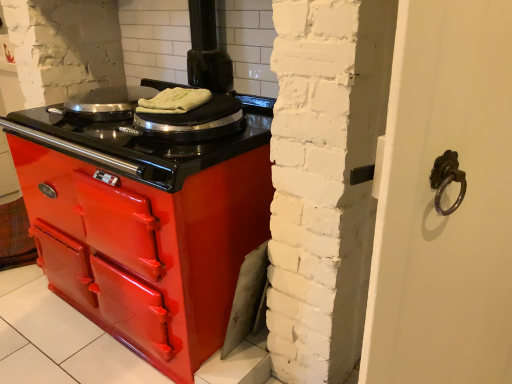
Identify the location of shiny metallic pan at upper left. This screenshot has height=384, width=512. (104, 103).

The image size is (512, 384). Describe the element at coordinates (104, 103) in the screenshot. I see `shiny metallic pan at upper left` at that location.

Where is `white cloth at center`? white cloth at center is located at coordinates (174, 101).

This screenshot has height=384, width=512. What do you see at coordinates (174, 101) in the screenshot?
I see `white cloth at center` at bounding box center [174, 101].

Where is `shiny metallic pan at upper left`? The height and width of the screenshot is (384, 512). shiny metallic pan at upper left is located at coordinates (104, 103).

Is shiny metallic pan at upper left to the left of white cloth at center from the viewer's perspective?

Yes, shiny metallic pan at upper left is to the left of white cloth at center.

Relative to white cloth at center, is shiny metallic pan at upper left in front or behind?

Clearly, shiny metallic pan at upper left is behind white cloth at center.

Considering the points (89, 100) and (156, 97), which point is behind, point (89, 100) or point (156, 97)?

The point (89, 100) is more distant.

From the image's perspective, does shiny metallic pan at upper left appear lower than white cloth at center?

No.

From a real-world perspective, is shiny metallic pan at upper left positioned above or below white cloth at center?

Clearly, from a real-world perspective, shiny metallic pan at upper left is below white cloth at center.

Which object is wider, shiny metallic pan at upper left or white cloth at center?

shiny metallic pan at upper left.

Who is taller, shiny metallic pan at upper left or white cloth at center?

shiny metallic pan at upper left.

Considering the relative sizes of shiny metallic pan at upper left and white cloth at center in the image provided, is shiny metallic pan at upper left bigger than white cloth at center?

Indeed, shiny metallic pan at upper left has a larger size compared to white cloth at center.

Choose the correct answer: Is shiny metallic pan at upper left inside white cloth at center or outside it?

shiny metallic pan at upper left cannot be found inside white cloth at center.

Are shiny metallic pan at upper left and white cloth at center located far from each other?

No, there isn't a large distance between shiny metallic pan at upper left and white cloth at center.

Is shiny metallic pan at upper left oriented towards white cloth at center?

No, shiny metallic pan at upper left is not aimed at white cloth at center.

How different are the orientations of shiny metallic pan at upper left and white cloth at center in degrees?

There is a 23.1-degree angle between the facing directions of shiny metallic pan at upper left and white cloth at center.

Measure the distance between shiny metallic pan at upper left and white cloth at center.

shiny metallic pan at upper left is 13.83 inches away from white cloth at center.

Locate an element on the screen. This screenshot has width=512, height=384. kitchen appliance lying behind the white cloth at center is located at coordinates (104, 103).

Would you say white cloth at center is to the left or to the right of shiny metallic pan at upper left in the picture?

Clearly, white cloth at center is on the right of shiny metallic pan at upper left in the image.

Considering the relative positions of white cloth at center and shiny metallic pan at upper left in the image provided, is white cloth at center behind shiny metallic pan at upper left?

No.

Is point (205, 91) farther from camera compared to point (97, 103)?

No, it is not.

From the image's perspective, is white cloth at center located beneath shiny metallic pan at upper left?

Yes.

From a real-world perspective, relative to shiny metallic pan at upper left, is white cloth at center vertically above or below?

white cloth at center is situated higher than shiny metallic pan at upper left in the real world.

Which of these two, white cloth at center or shiny metallic pan at upper left, is thinner?

white cloth at center.

Is white cloth at center taller or shorter than shiny metallic pan at upper left?

Considering their sizes, white cloth at center has less height than shiny metallic pan at upper left.

Does white cloth at center have a smaller size compared to shiny metallic pan at upper left?

Yes, white cloth at center is smaller than shiny metallic pan at upper left.

Is white cloth at center outside of shiny metallic pan at upper left?

white cloth at center lies outside shiny metallic pan at upper left's area.

Are white cloth at center and shiny metallic pan at upper left beside each other?

No, white cloth at center is not in contact with shiny metallic pan at upper left.

Is shiny metallic pan at upper left at the back of white cloth at center?

No.

How many degrees apart are the facing directions of white cloth at center and shiny metallic pan at upper left?

The angle between the facing direction of white cloth at center and the facing direction of shiny metallic pan at upper left is 23.1 degrees.

The width and height of the screenshot is (512, 384). I want to click on kitchen appliance that appears below the white cloth at center (from a real-world perspective), so pos(104,103).

Find the location of a particular element. This screenshot has width=512, height=384. food on the right of the shiny metallic pan at upper left is located at coordinates (174, 101).

Find the location of a particular element. food above the shiny metallic pan at upper left (from a real-world perspective) is located at coordinates (174, 101).